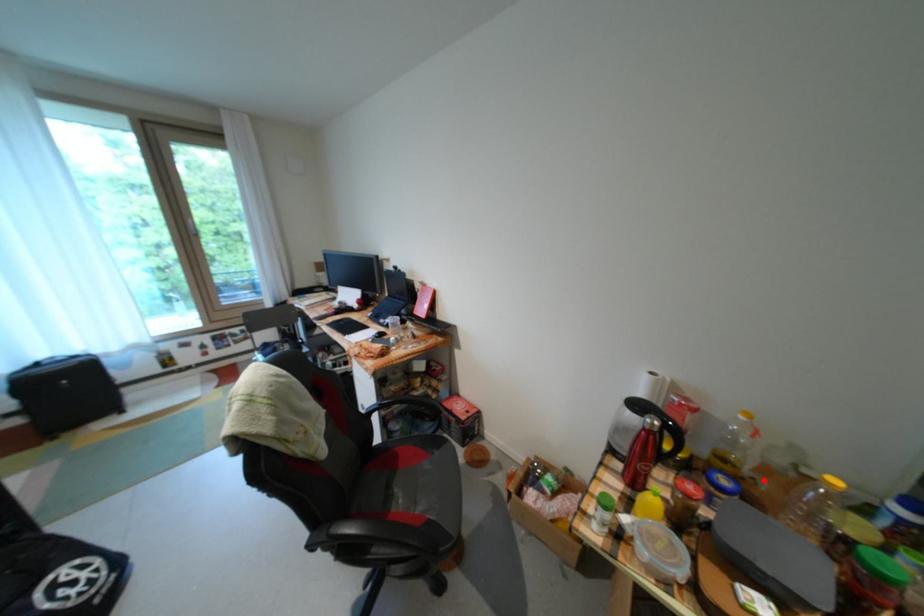
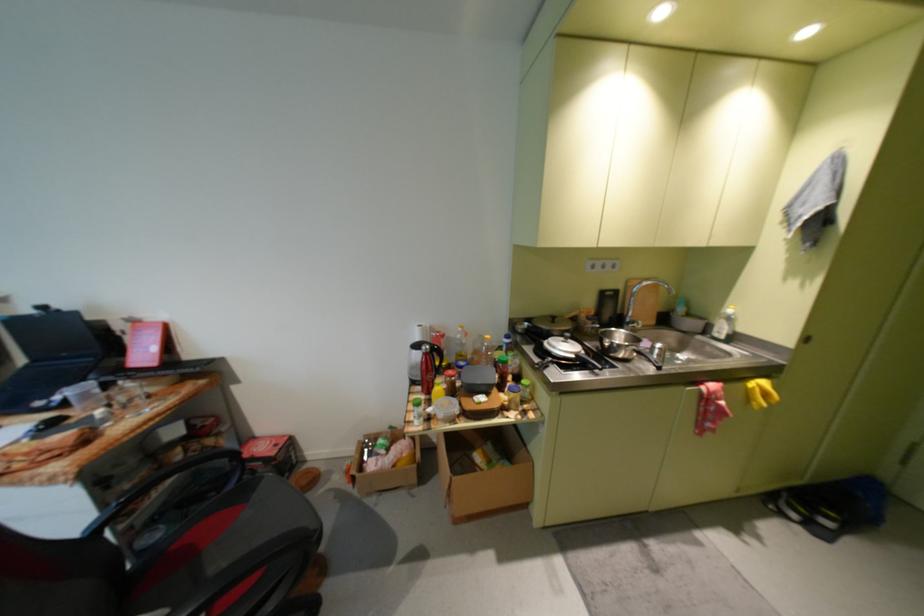
The point at the highlighted location is marked in the first image. Where is the corresponding point in the second image?

(482, 359)